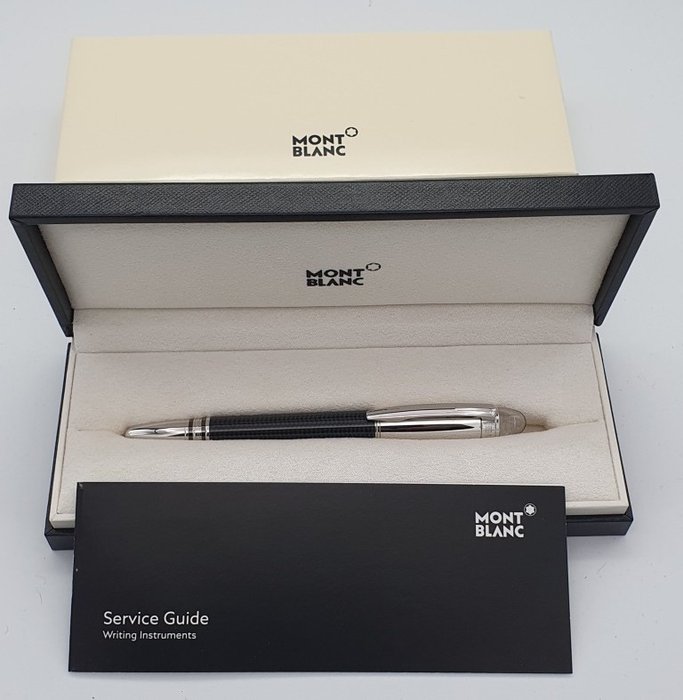
Find the location of a particular element. This screenshot has height=700, width=683. black and silver pen is located at coordinates (268, 423).